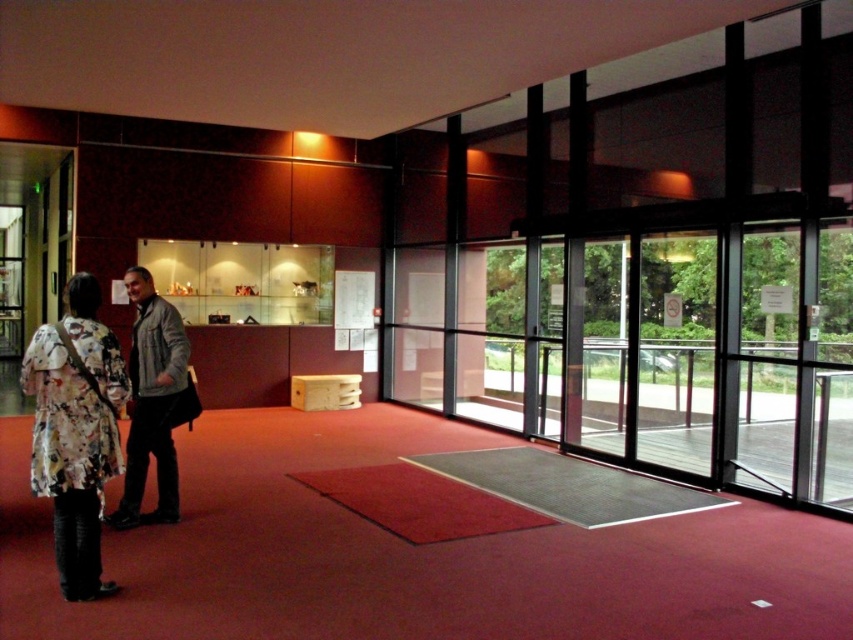
Looking at this image, you are a visitor in this modern building and want to take a photo of the gray fabric jacket at center without the floral fabric dress at left appearing in the background. Is this possible given their positions?

The floral fabric dress at left is closer to the viewer than the gray fabric jacket at center. Therefore, if you position yourself so that the floral fabric dress at left is out of the frame or behind the gray fabric jacket at center, you might be able to exclude it from the photo. However, since the floral fabric dress at left is closer, it may still appear in the background unless physically moved or blocked.

You are a fashion designer visiting the museum and see the floral fabric dress at left and the gray fabric jacket at center. Which piece of clothing is larger in size?

The gray fabric jacket at center is larger than the floral fabric dress at left.

You are a visitor in the museum and want to take a photo of the gray fabric jacket at center without the floral fabric dress at left appearing in the frame. Is this possible based on their positions?

The floral fabric dress at left is positioned under the gray fabric jacket at center, so if you angle your camera upwards to focus on the jacket, the dress might still be visible below it. Alternatively, moving to the side could help frame the jacket without the dress, but the description does not specify their horizontal alignment. Without more details on their horizontal positions, it is uncertain if the dress can be fully excluded from the frame.